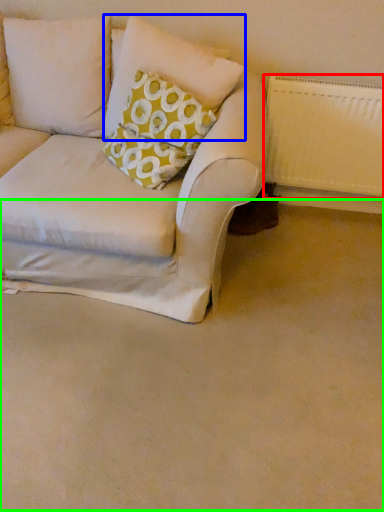
Question: Which is farther away from radiator (highlighted by a red box)? pillow (highlighted by a blue box) or plain (highlighted by a green box)?

Choices:
 (A) pillow
 (B) plain

Answer: (B)